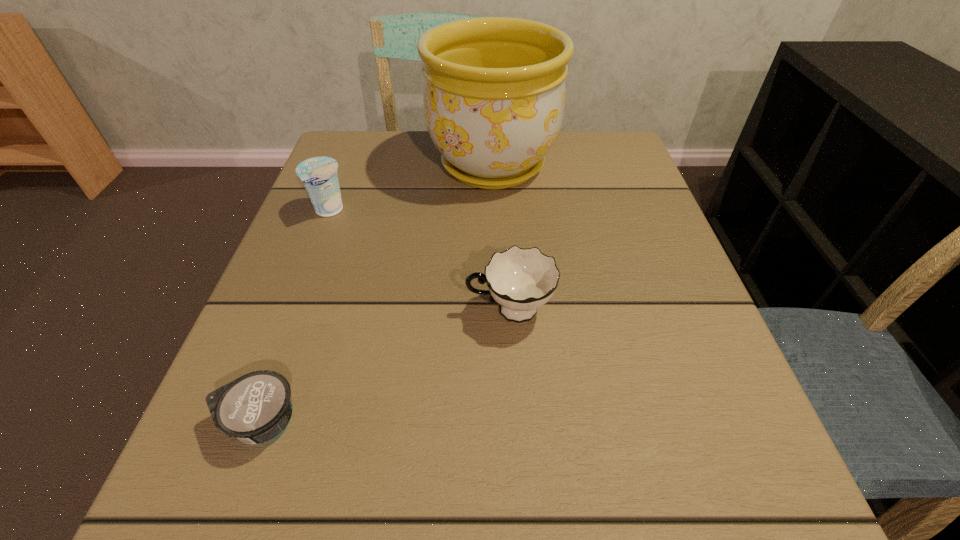
Where is `free region at the far right corner of the desktop`? The height and width of the screenshot is (540, 960). free region at the far right corner of the desktop is located at coordinates (570, 171).

Identify the location of empty location between the nearest object and the flowerpot. (376, 293).

The width and height of the screenshot is (960, 540). I want to click on free space between the second nearest object and the nearest object, so click(x=385, y=366).

Identify the location of free spot between the farther yogurt and the tallest object. Image resolution: width=960 pixels, height=540 pixels. (411, 188).

Where is `blank region between the nearest object and the flowerpot`? blank region between the nearest object and the flowerpot is located at coordinates (376, 293).

You are a GUI agent. You are given a task and a screenshot of the screen. Output one action in this format:
    pyautogui.click(x=<x>, y=<y>)
    Task: Click on the vacant point located between the taller yogurt and the third farthest object
    
    Given the screenshot: What is the action you would take?
    pyautogui.click(x=420, y=261)

Find the location of a particular element. The image size is (960, 540). free space that is in between the tallest object and the nearest object is located at coordinates (376, 293).

Where is `vacant space in between the flowerpot and the cup`? Image resolution: width=960 pixels, height=540 pixels. vacant space in between the flowerpot and the cup is located at coordinates (501, 238).

The height and width of the screenshot is (540, 960). I want to click on free space between the farther yogurt and the shortest object, so click(295, 316).

Where is `vacant space that is in between the taller yogurt and the second nearest object`? vacant space that is in between the taller yogurt and the second nearest object is located at coordinates click(x=420, y=261).